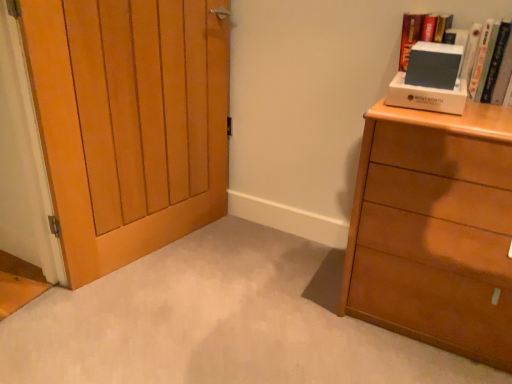
At what (x,y) coordinates should I click in order to perform the action: click on free space below wooden door at left (from a real-world perspective). Please return your answer as a coordinate pair (x, y). Looking at the image, I should click on (158, 244).